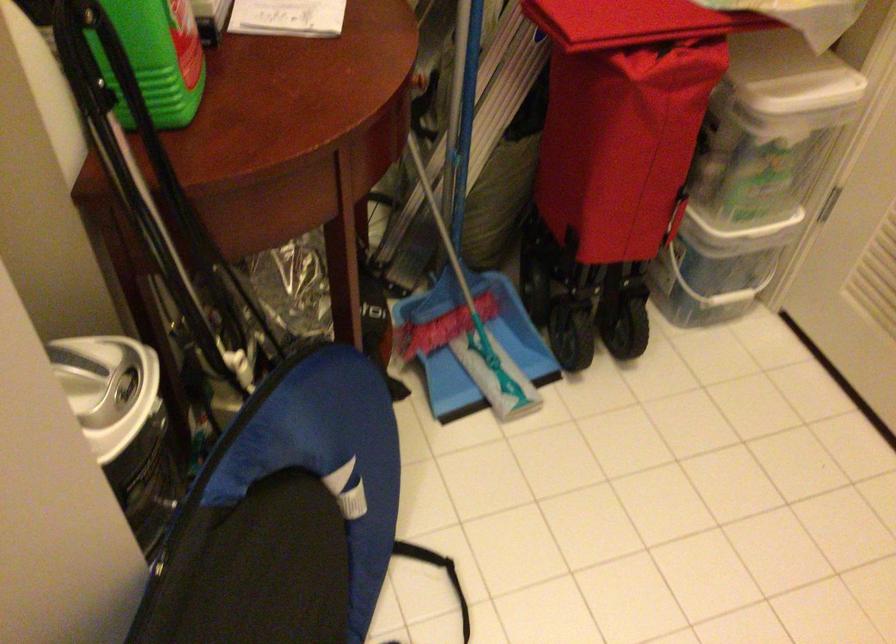
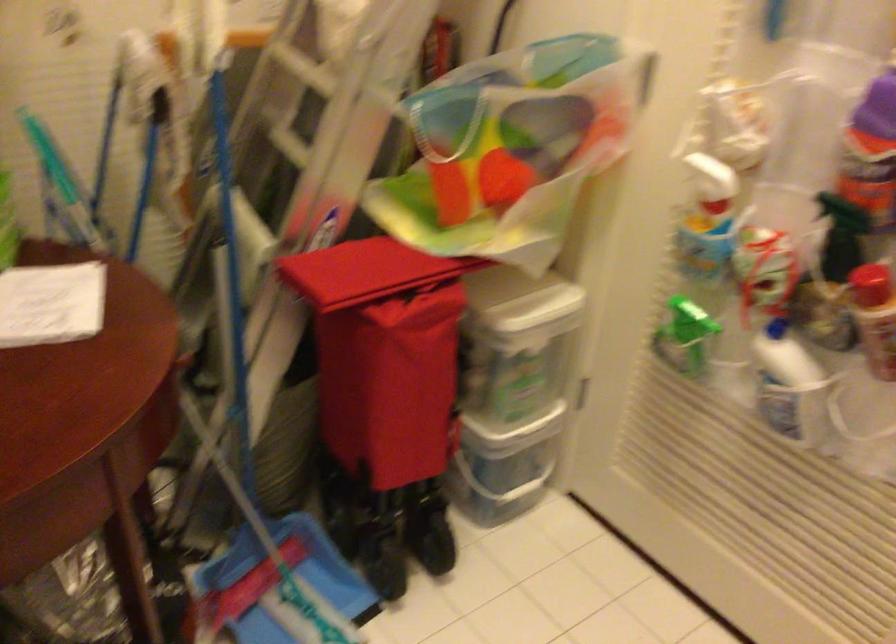
Question: The images are taken continuously from a first-person perspective. In which direction is your viewpoint rotating?

Choices:
 (A) Left
 (B) Right
 (C) Up
 (D) Down

Answer: (B)